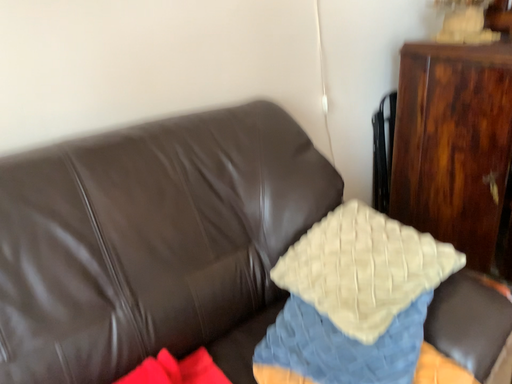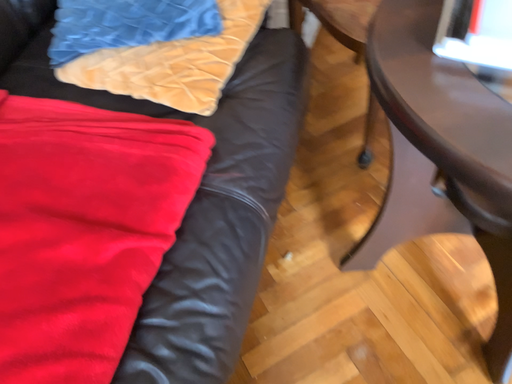
Question: How did the camera likely rotate when shooting the video?

Choices:
 (A) rotated upward
 (B) rotated downward

Answer: (B)